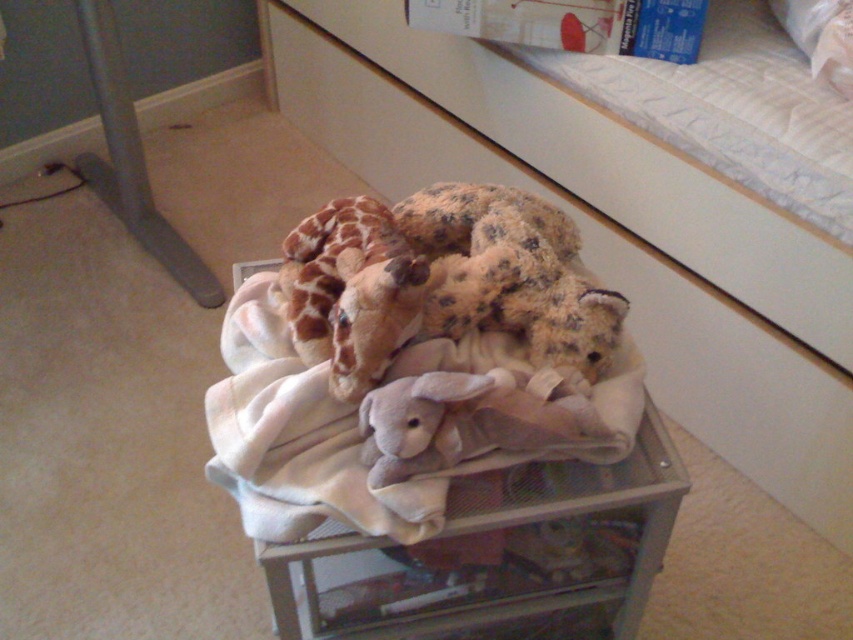
Is gray mesh crate at center to the left of beige soft blanket at center from the viewer's perspective?

No, gray mesh crate at center is not to the left of beige soft blanket at center.

Can you confirm if gray mesh crate at center is positioned to the right of beige soft blanket at center?

Indeed, gray mesh crate at center is positioned on the right side of beige soft blanket at center.

Who is more forward, (642, 428) or (440, 500)?

Point (440, 500)

Where is `gray mesh crate at center`? gray mesh crate at center is located at coordinates (497, 557).

Which of these two, beige fabric dresser at center or beige soft blanket at center, stands taller?

beige fabric dresser at center

The height and width of the screenshot is (640, 853). What are the coordinates of `beige fabric dresser at center` in the screenshot? It's located at (589, 266).

This screenshot has width=853, height=640. In order to click on beige fabric dresser at center in this screenshot , I will do `click(589, 266)`.

Can you confirm if beige fabric dresser at center is taller than fluffy brown teddy bear at center?

Indeed, beige fabric dresser at center has a greater height compared to fluffy brown teddy bear at center.

Which is behind, point (659, 275) or point (466, 193)?

The point (659, 275) is more distant.

Locate an element on the screen. The image size is (853, 640). beige fabric dresser at center is located at coordinates (589, 266).